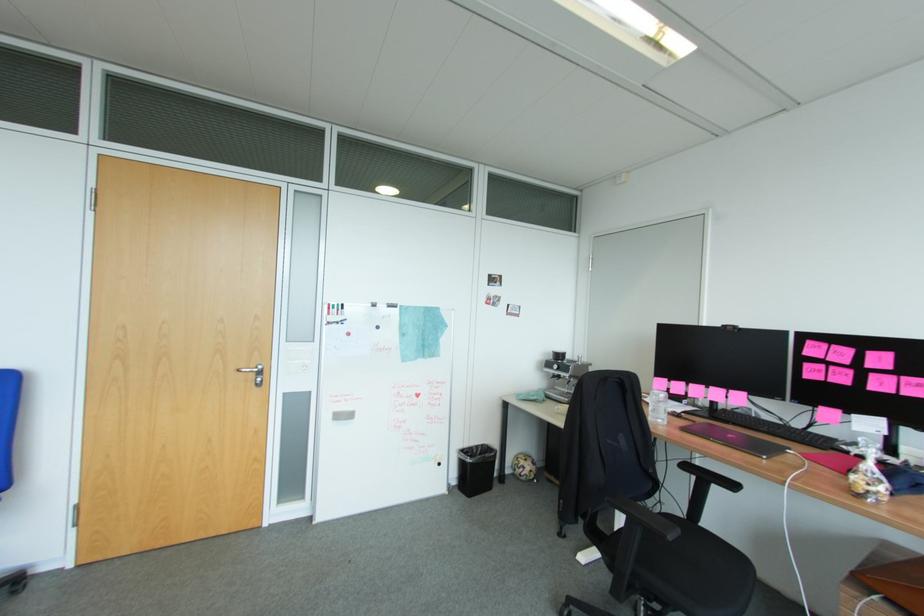
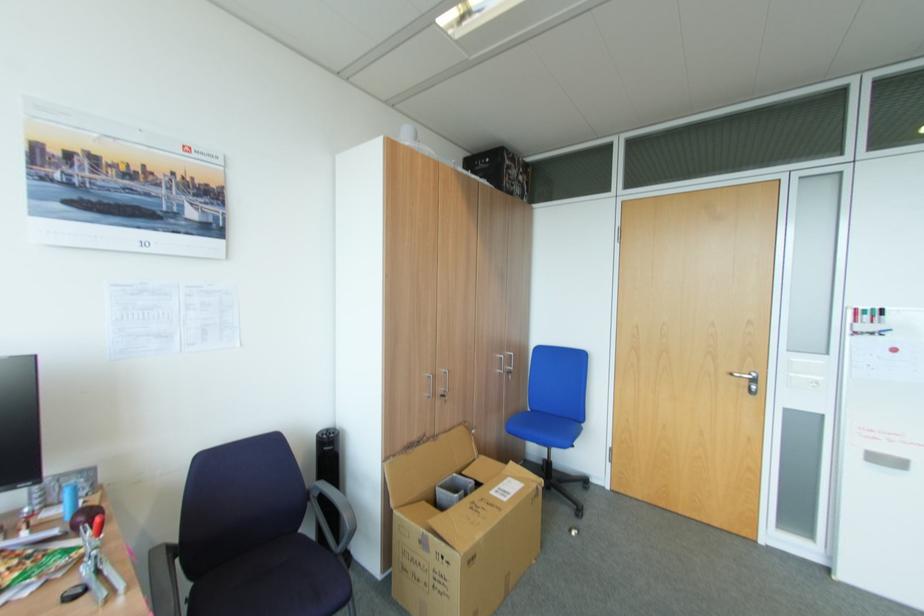
Find the pixel in the second image that matches pixel 258 374 in the first image.

(751, 381)